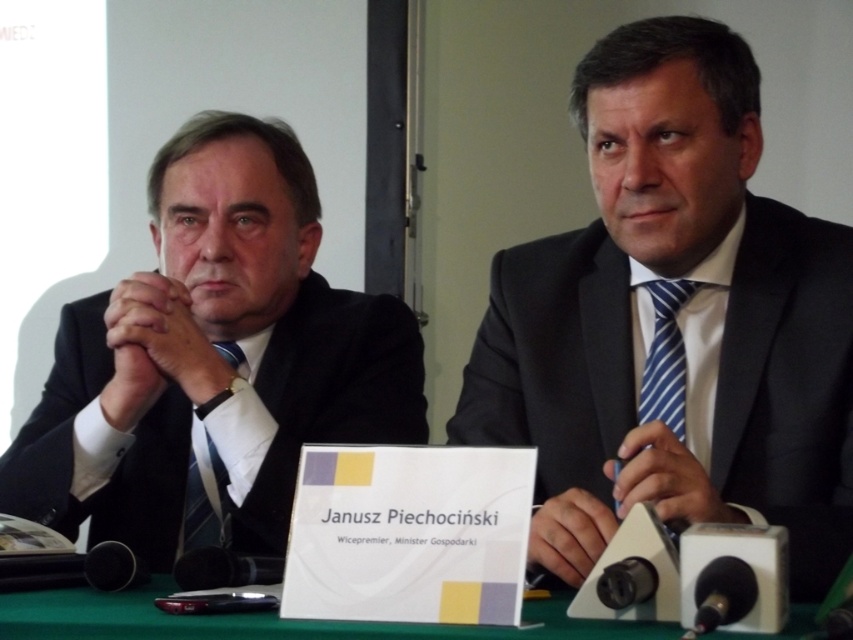
Question: Which of the following is the closest to the observer?

Choices:
 (A) (606, 253)
 (B) (247, 616)
 (C) (665, 280)
 (D) (189, 515)

Answer: (B)

Question: Does matte black suit at right have a greater width compared to green fabric table at center?

Choices:
 (A) no
 (B) yes

Answer: (A)

Question: Where is matte black suit at right located in relation to blue striped tie at right in the image?

Choices:
 (A) right
 (B) left

Answer: (B)

Question: Considering the real-world distances, which object is farthest from the blue striped tie at right?

Choices:
 (A) green fabric table at center
 (B) matte black tie at center

Answer: (B)

Question: Considering the real-world distances, which object is farthest from the black suit at left?

Choices:
 (A) blue striped tie at right
 (B) green fabric table at center
 (C) matte black suit at right

Answer: (A)

Question: Can you confirm if blue striped tie at right is wider than matte black tie at center?

Choices:
 (A) yes
 (B) no

Answer: (A)